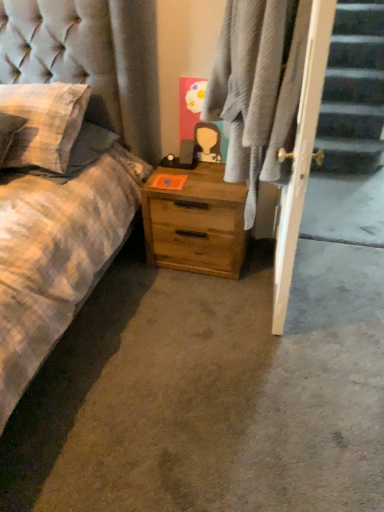
Question: In the image, is plaid fabric at center positioned in front of or behind checkered fabric pillow at left?

Choices:
 (A) front
 (B) behind

Answer: (A)

Question: Is plaid fabric at center wider or thinner than checkered fabric pillow at left?

Choices:
 (A) thin
 (B) wide

Answer: (A)

Question: Estimate the real-world distances between objects in this image. Which object is closer to the wooden nightstand at center?

Choices:
 (A) checkered fabric pillow at left
 (B) plaid fabric at center

Answer: (B)

Question: Considering the real-world distances, which object is closest to the wooden nightstand at center?

Choices:
 (A) plaid fabric at center
 (B) checkered fabric pillow at left

Answer: (A)